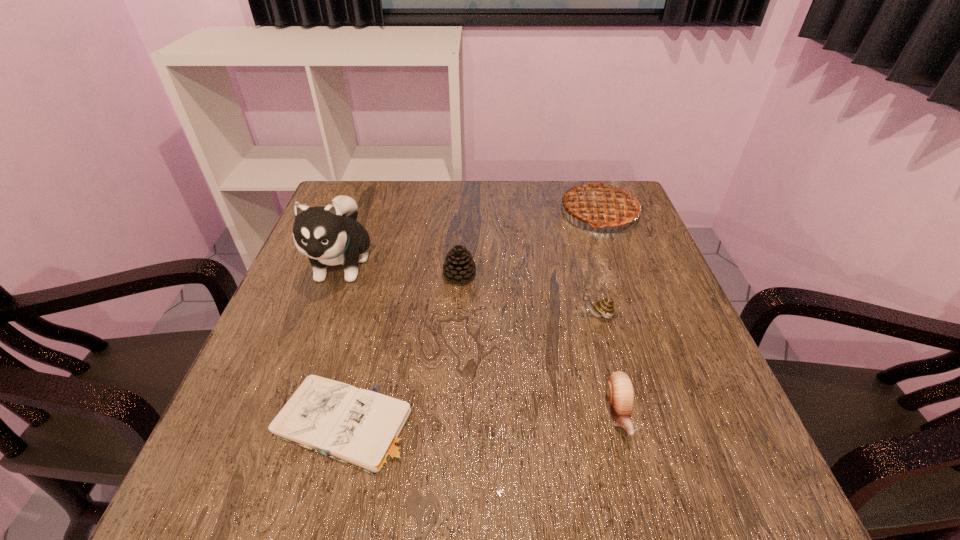
The height and width of the screenshot is (540, 960). What are the coordinates of `blank space located 0.320m on the face of the fourth farthest object` in the screenshot? It's located at point(426,315).

The image size is (960, 540). Find the location of `blank area located 0.170m on the face of the fourth farthest object`. blank area located 0.170m on the face of the fourth farthest object is located at coordinates (497, 315).

Where is `vacant space situated 0.110m on the face of the fourth farthest object`? The width and height of the screenshot is (960, 540). vacant space situated 0.110m on the face of the fourth farthest object is located at coordinates (525, 315).

Find the location of a particular element. The width and height of the screenshot is (960, 540). blank space located on the front-facing side of the nearer escargot is located at coordinates 635,476.

Identify the location of vacant space located on the right of the shortest object. Image resolution: width=960 pixels, height=540 pixels. (629, 423).

The height and width of the screenshot is (540, 960). Identify the location of object that is positioned at the far edge. (604, 203).

Locate an element on the screen. This screenshot has height=540, width=960. object present at the near edge is located at coordinates (365, 429).

The image size is (960, 540). I want to click on puppy situated at the left edge, so click(x=330, y=235).

Identify the location of notebook that is at the left edge. The width and height of the screenshot is (960, 540). (365, 429).

Find the location of a particular element. The image size is (960, 540). pie that is at the right edge is located at coordinates (604, 203).